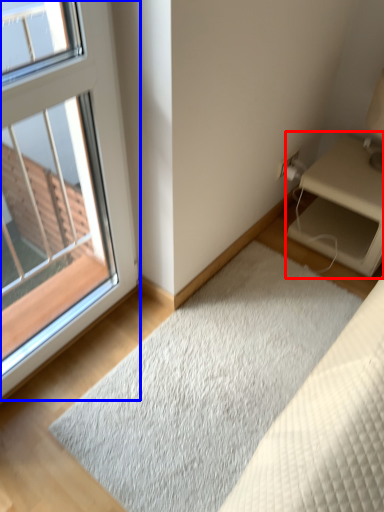
Question: Which of the following is the closest to the observer, nightstand (highlighted by a red box) or window (highlighted by a blue box)?

Choices:
 (A) nightstand
 (B) window

Answer: (B)